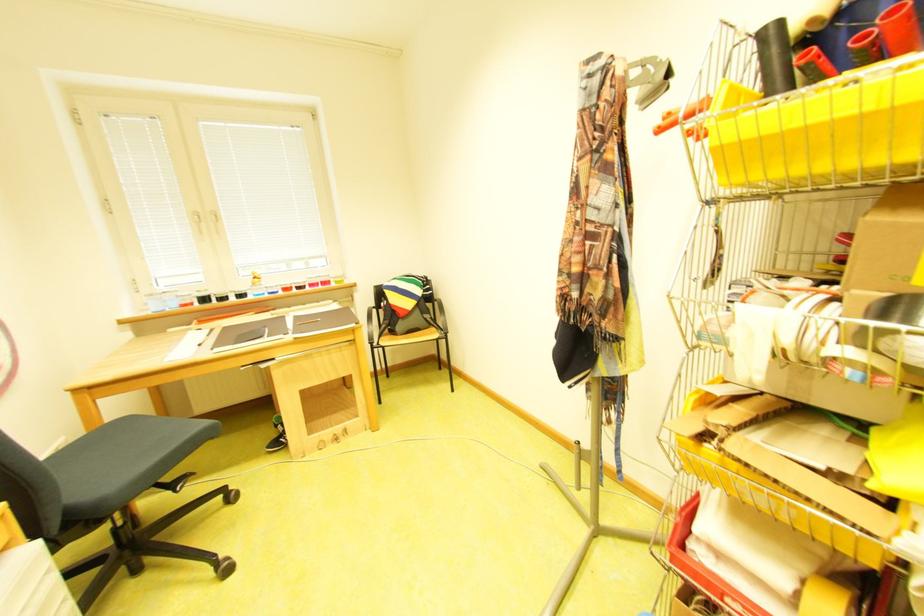
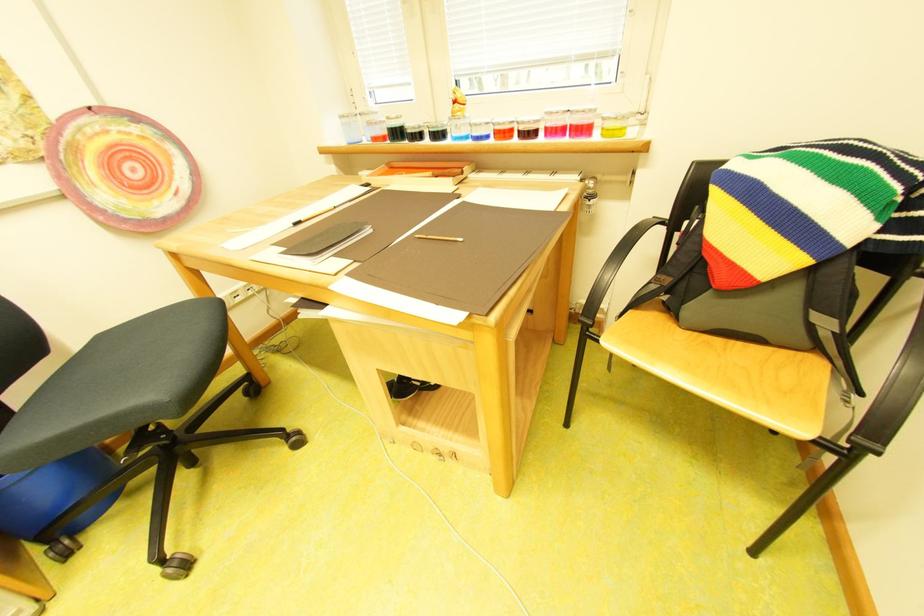
Locate, in the second image, the point that corresponds to pixel 216 301 in the first image.

(407, 135)